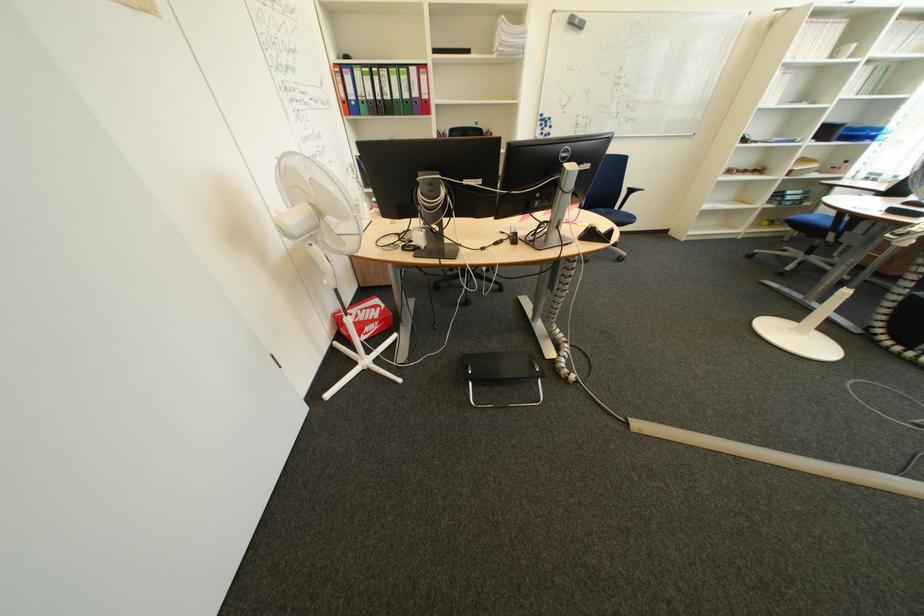
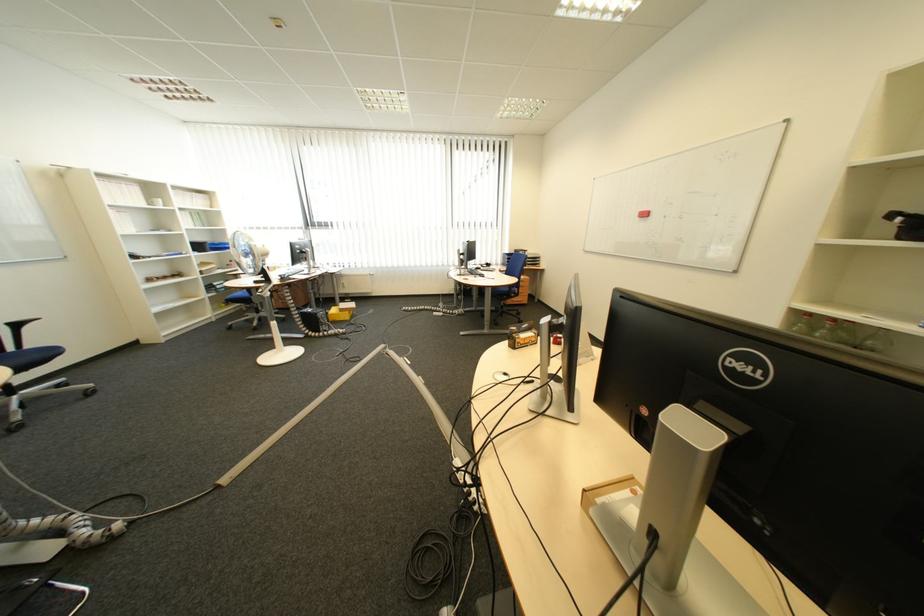
How did the camera likely rotate?

The camera rotated toward right-down.